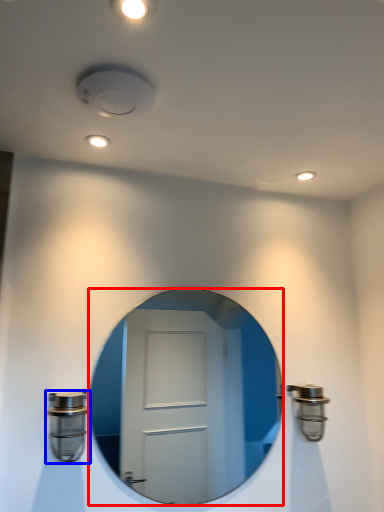
Question: Which of the following is the closest to the observer, mirror (highlighted by a red box) or door handle (highlighted by a blue box)?

Choices:
 (A) mirror
 (B) door handle

Answer: (B)